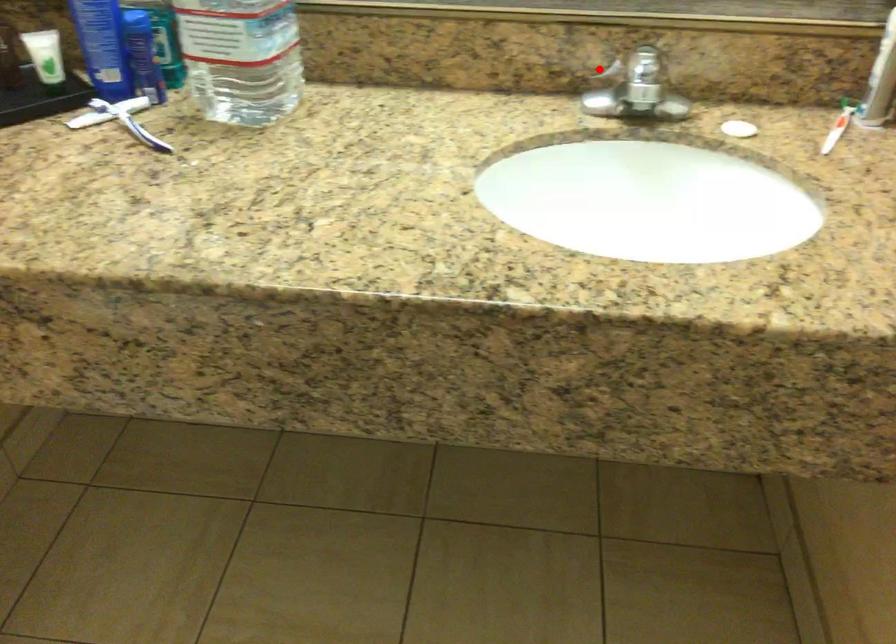
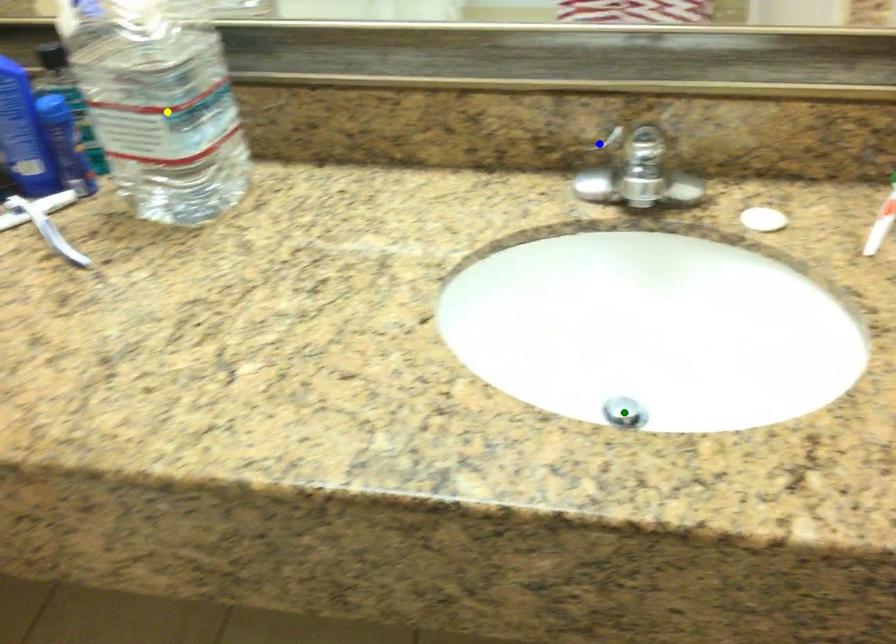
Question: I am providing you with two images of the same scene from different viewpoints. A red point is marked on the first image. You are given multiple points on the second image. Which spot in image 2 lines up with the point in image 1?

Choices:
 (A) blue point
 (B) yellow point
 (C) green point

Answer: (A)